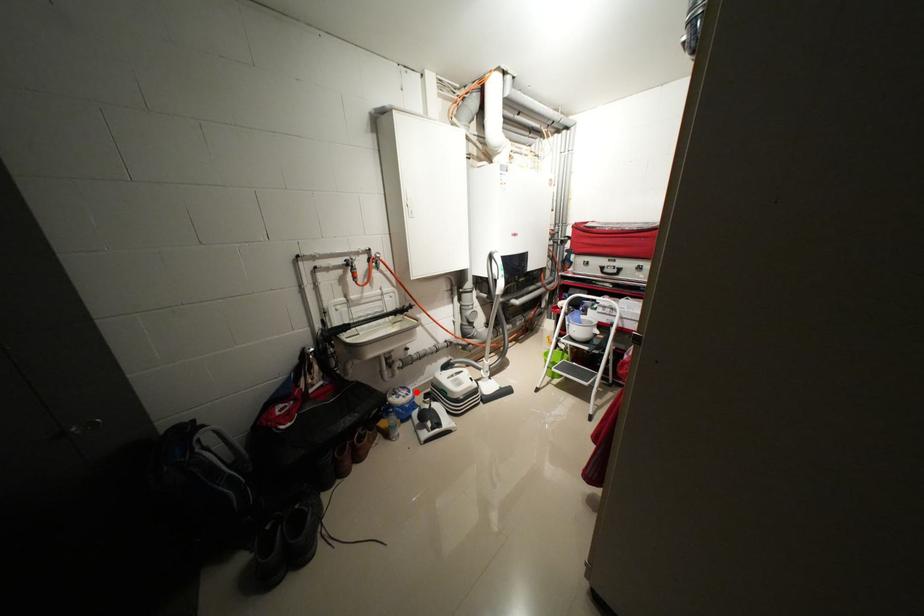
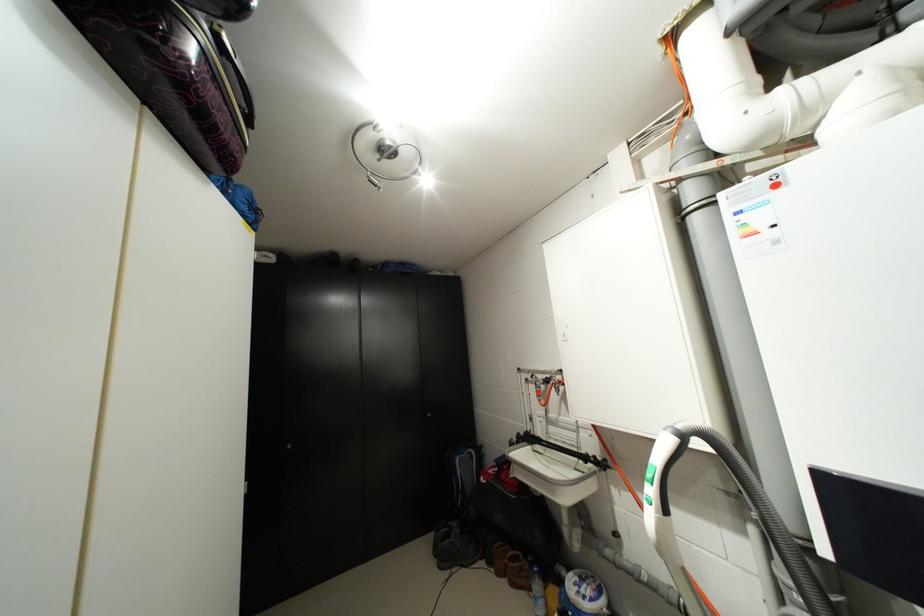
Locate, in the second image, the point that corresponds to the highlighted location in the first image.

(599, 600)